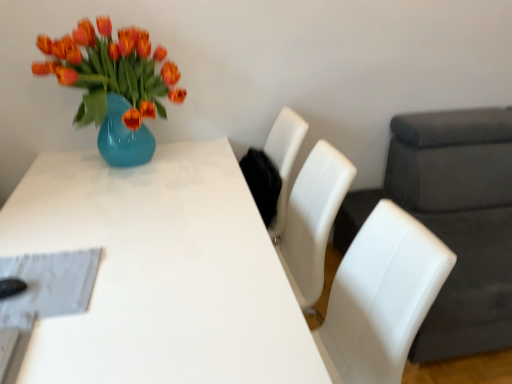
Question: Considering their positions, is white leather swivel chair at right located in front of or behind white glossy table at center?

Choices:
 (A) front
 (B) behind

Answer: (B)

Question: Is white leather swivel chair at right situated inside white glossy table at center or outside?

Choices:
 (A) outside
 (B) inside

Answer: (A)

Question: In terms of height, does white leather swivel chair at right look taller or shorter compared to white glossy table at center?

Choices:
 (A) short
 (B) tall

Answer: (B)

Question: Considering the positions of white glossy table at center and white leather swivel chair at right in the image, is white glossy table at center bigger or smaller than white leather swivel chair at right?

Choices:
 (A) big
 (B) small

Answer: (B)

Question: Is white glossy table at center inside the boundaries of white leather swivel chair at right, or outside?

Choices:
 (A) outside
 (B) inside

Answer: (A)

Question: From a real-world perspective, is white glossy table at center physically located above or below white leather swivel chair at right?

Choices:
 (A) above
 (B) below

Answer: (B)

Question: From the image's perspective, is white glossy table at center above or below white leather swivel chair at right?

Choices:
 (A) above
 (B) below

Answer: (B)